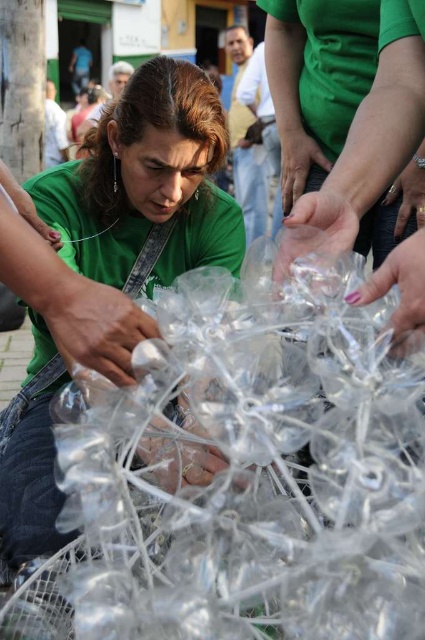
Based on the photo, does transparent plastic at center appear on the left side of green matte shirt at center?

In fact, transparent plastic at center is to the right of green matte shirt at center.

Is point (376, 272) positioned behind point (37, 413)?

No, (376, 272) is in front of (37, 413).

Does point (388, 353) come behind point (23, 435)?

No, (388, 353) is in front of (23, 435).

Where is `transparent plastic at center`? The height and width of the screenshot is (640, 425). transparent plastic at center is located at coordinates (246, 468).